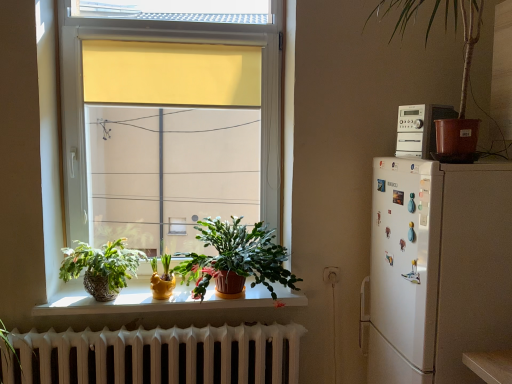
Question: Does matte yellow pot at window, the 1th houseplant when ordered from bottom to top, have a lesser height compared to white matte stereo at upper right?

Choices:
 (A) yes
 (B) no

Answer: (A)

Question: From the image's perspective, is matte yellow pot at window, the 1th houseplant when ordered from bottom to top, located beneath white matte stereo at upper right?

Choices:
 (A) yes
 (B) no

Answer: (A)

Question: From the image's perspective, does matte yellow pot at window, which ranks as the 2th houseplant in left-to-right order, appear higher than white matte stereo at upper right?

Choices:
 (A) yes
 (B) no

Answer: (B)

Question: Considering the relative positions of matte yellow pot at window, which ranks as the 2th houseplant in left-to-right order, and white matte stereo at upper right in the image provided, is matte yellow pot at window, which ranks as the 2th houseplant in left-to-right order, in front of white matte stereo at upper right?

Choices:
 (A) yes
 (B) no

Answer: (B)

Question: From a real-world perspective, is matte yellow pot at window, the third houseplant positioned from the right, positioned under white matte stereo at upper right based on gravity?

Choices:
 (A) yes
 (B) no

Answer: (A)

Question: In the image, is green matte plant at center, the 2th houseplant viewed from the top, positioned in front of or behind brown plastic pot at upper right, which ranks as the fourth houseplant in left-to-right order?

Choices:
 (A) behind
 (B) front

Answer: (A)

Question: From a real-world perspective, is green matte plant at center, the third houseplant when ordered from left to right, positioned above or below brown plastic pot at upper right, arranged as the 1th houseplant when viewed from the right?

Choices:
 (A) below
 (B) above

Answer: (A)

Question: Is green matte plant at center, the second houseplant when ordered from right to left, spatially inside brown plastic pot at upper right, which ranks as the fourth houseplant in left-to-right order, or outside of it?

Choices:
 (A) outside
 (B) inside

Answer: (A)

Question: Looking at the image, does green matte plant at center, the 2th houseplant viewed from the top, seem bigger or smaller compared to brown plastic pot at upper right, which ranks as the fourth houseplant in left-to-right order?

Choices:
 (A) big
 (B) small

Answer: (B)

Question: Considering the positions of brown plastic pot at upper right, acting as the first houseplant starting from the top, and white matte stereo at upper right in the image, is brown plastic pot at upper right, acting as the first houseplant starting from the top, bigger or smaller than white matte stereo at upper right?

Choices:
 (A) big
 (B) small

Answer: (A)

Question: From a real-world perspective, is brown plastic pot at upper right, which ranks as the fourth houseplant in left-to-right order, above or below white matte stereo at upper right?

Choices:
 (A) below
 (B) above

Answer: (B)

Question: From the image's perspective, is brown plastic pot at upper right, which ranks as the fourth houseplant in left-to-right order, above or below white matte stereo at upper right?

Choices:
 (A) above
 (B) below

Answer: (A)

Question: Visually, is brown plastic pot at upper right, which ranks as the fourth houseplant in left-to-right order, positioned to the left or to the right of white matte stereo at upper right?

Choices:
 (A) right
 (B) left

Answer: (B)

Question: Is point (224, 284) closer or farther from the camera than point (104, 251)?

Choices:
 (A) closer
 (B) farther

Answer: (A)

Question: In terms of width, does green matte plant at center, the third houseplant when ordered from left to right, look wider or thinner when compared to textured wicker basket at lower left, arranged as the 3th houseplant when viewed from the top?

Choices:
 (A) wide
 (B) thin

Answer: (A)